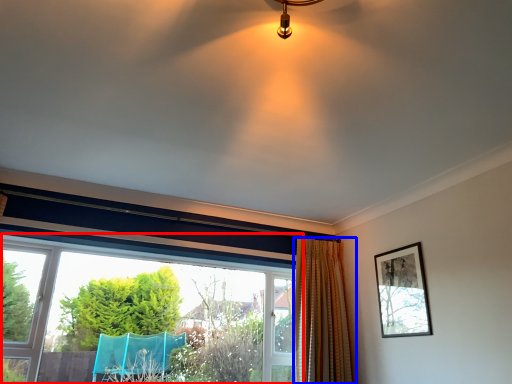
Question: Among these objects, which one is farthest to the camera, window (highlighted by a red box) or curtain (highlighted by a blue box)?

Choices:
 (A) window
 (B) curtain

Answer: (B)